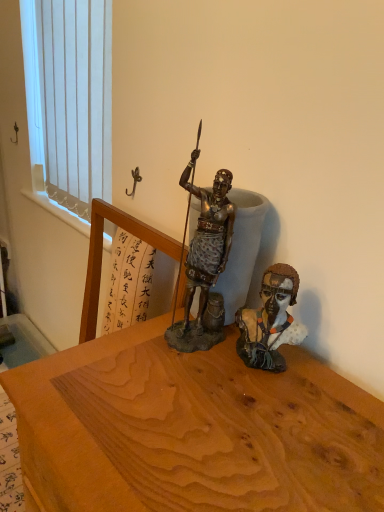
Question: Could you tell me if matte brown bust at center right is turned towards white vertical blinds at upper left?

Choices:
 (A) yes
 (B) no

Answer: (B)

Question: Is matte brown bust at center right positioned with its back to white vertical blinds at upper left?

Choices:
 (A) no
 (B) yes

Answer: (A)

Question: Is the depth of matte brown bust at center right less than that of white vertical blinds at upper left?

Choices:
 (A) yes
 (B) no

Answer: (A)

Question: Is the surface of matte brown bust at center right in direct contact with white vertical blinds at upper left?

Choices:
 (A) no
 (B) yes

Answer: (A)

Question: Can you confirm if matte brown bust at center right is thinner than white vertical blinds at upper left?

Choices:
 (A) no
 (B) yes

Answer: (A)

Question: Is matte brown bust at center right positioned behind white vertical blinds at upper left?

Choices:
 (A) yes
 (B) no

Answer: (B)

Question: From the image's perspective, would you say white vertical blinds at upper left is shown under matte brown bust at center right?

Choices:
 (A) yes
 (B) no

Answer: (B)

Question: Does white vertical blinds at upper left have a lesser width compared to matte brown bust at center right?

Choices:
 (A) yes
 (B) no

Answer: (A)

Question: Is white vertical blinds at upper left facing away from matte brown bust at center right?

Choices:
 (A) no
 (B) yes

Answer: (A)

Question: From a real-world perspective, is white vertical blinds at upper left physically below matte brown bust at center right?

Choices:
 (A) no
 (B) yes

Answer: (A)

Question: Does white vertical blinds at upper left have a greater height compared to matte brown bust at center right?

Choices:
 (A) no
 (B) yes

Answer: (B)

Question: Is white vertical blinds at upper left not within matte brown bust at center right?

Choices:
 (A) no
 (B) yes

Answer: (B)

Question: Considering the positions of matte brown bust at center right and white vertical blinds at upper left in the image, is matte brown bust at center right taller or shorter than white vertical blinds at upper left?

Choices:
 (A) short
 (B) tall

Answer: (A)